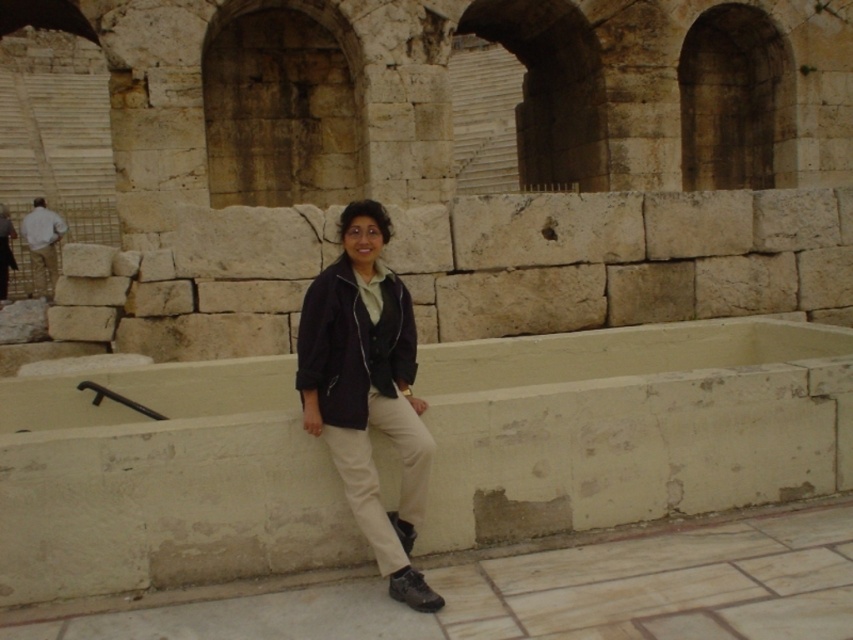
Between light brown leather pants at left and matte black jacket at center, which one has less height?

With less height is light brown leather pants at left.

This screenshot has height=640, width=853. Describe the element at coordinates (42, 243) in the screenshot. I see `light brown leather pants at left` at that location.

At what (x,y) coordinates should I click in order to perform the action: click on light brown leather pants at left. Please return your answer as a coordinate pair (x, y). This screenshot has width=853, height=640. Looking at the image, I should click on (42, 243).

In the scene shown: Does dark blue jacket at center appear over matte black jacket at center?

Actually, dark blue jacket at center is below matte black jacket at center.

Who is more forward, (349, 296) or (4, 214)?

Point (349, 296) is in front.

Locate an element on the screen. dark blue jacket at center is located at coordinates (367, 390).

I want to click on dark blue jacket at center, so click(x=367, y=390).

Is dark blue jacket at center to the right of light brown leather pants at left from the viewer's perspective?

Indeed, dark blue jacket at center is positioned on the right side of light brown leather pants at left.

Which is in front, point (354, 202) or point (24, 224)?

Point (354, 202) is in front.

The image size is (853, 640). What are the coordinates of `dark blue jacket at center` in the screenshot? It's located at (367, 390).